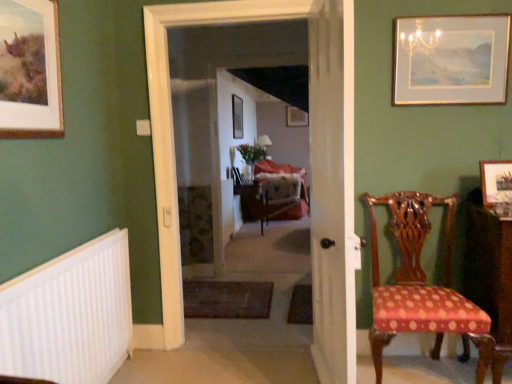
Question: Is point (348, 233) closer or farther from the camera than point (264, 173)?

Choices:
 (A) closer
 (B) farther

Answer: (A)

Question: Is white wooden door at center inside the boundaries of velvet upholstered swivel chair at center, or outside?

Choices:
 (A) outside
 (B) inside

Answer: (A)

Question: Which is nearer to the wooden picture frame at center, the second picture frame in the left-to-right sequence?

Choices:
 (A) polka dot fabric chair at right
 (B) white plastic radiator at lower left
 (C) velvet upholstered swivel chair at center
 (D) wooden picture frame at right, acting as the fifth picture frame starting from the left
 (E) carpeted floor at center, which is the 2th corridor from back to front

Answer: (C)

Question: Which of these objects is positioned closest to the white plastic radiator at lower left?

Choices:
 (A) wooden picture frame at center, which is the second picture frame from back to front
 (B) wooden picture frame at center, the 5th picture frame in the front-to-back sequence
 (C) polka dot fabric chair at right
 (D) floral-patterned fabric at center, the second corridor viewed from the front
 (E) carpeted floor at center, which is the 2th corridor from back to front

Answer: (C)